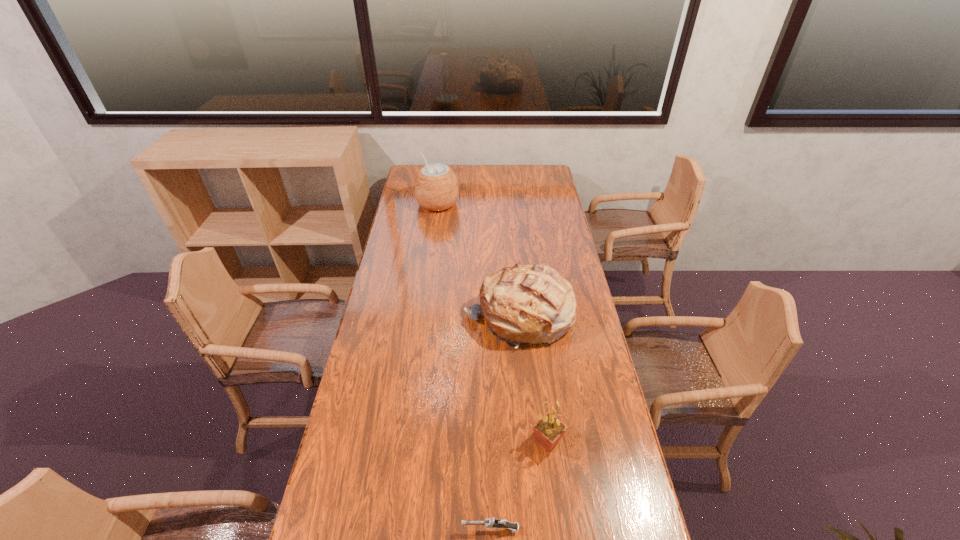
The image size is (960, 540). What are the coordinates of `vacant region located 0.160m at the front of the second nearest object with flowers visible` in the screenshot? It's located at (477, 441).

This screenshot has height=540, width=960. I want to click on free space located at the front of the second nearest object with flowers visible, so click(x=514, y=441).

You are a GUI agent. You are given a task and a screenshot of the screen. Output one action in this format:
    pyautogui.click(x=<x>, y=<y>)
    Task: Click on the vacant space located 0.390m at the front of the second nearest object with flowers visible
    
    Given the screenshot: What is the action you would take?
    pyautogui.click(x=400, y=441)

Where is `vacant area situated 0.330m aimed along the barrel of the shortest object`? vacant area situated 0.330m aimed along the barrel of the shortest object is located at coordinates (334, 529).

Identify the location of free location located 0.250m aimed along the barrel of the shortest object. (365, 529).

The width and height of the screenshot is (960, 540). Find the location of `free space located aimed along the barrel of the shortest object`. free space located aimed along the barrel of the shortest object is located at coordinates (349, 529).

What are the coordinates of `object present at the left edge` in the screenshot? It's located at (436, 188).

This screenshot has width=960, height=540. Identify the location of object that is positioned at the right edge. (532, 304).

The height and width of the screenshot is (540, 960). In the image, there is a desktop. Identify the location of vacant space at the far edge. pyautogui.click(x=511, y=172).

What are the coordinates of `vacant region at the left edge of the desktop` in the screenshot? It's located at (424, 210).